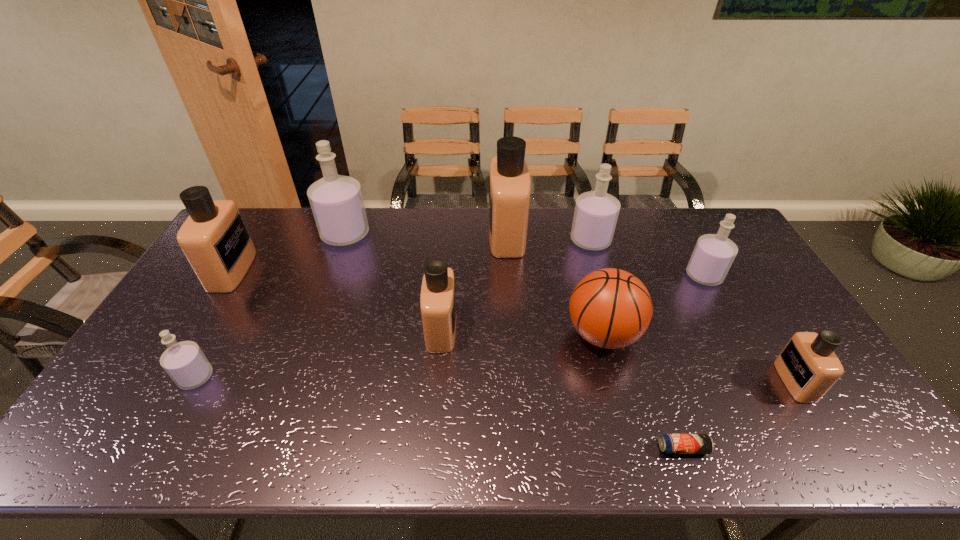
This screenshot has width=960, height=540. What are the coordinates of `vacant space located on the front label of the biggest beige perfume` in the screenshot? It's located at (444, 235).

Where is `free space located on the front of the biggest purple perfume`? This screenshot has width=960, height=540. free space located on the front of the biggest purple perfume is located at coordinates (330, 277).

I want to click on vacant space located 0.120m on the front label of the third smallest beige perfume, so click(x=285, y=270).

The image size is (960, 540). In order to click on free space located on the left of the second purple perfume from right to left in this screenshot , I will do `click(492, 240)`.

You are a GUI agent. You are given a task and a screenshot of the screen. Output one action in this format:
    pyautogui.click(x=<x>, y=<y>)
    Task: Click on the vacant region located on the back of the rightmost purple perfume
    The height and width of the screenshot is (540, 960).
    Given the screenshot: What is the action you would take?
    pyautogui.click(x=667, y=208)

Locate an element on the screen. The image size is (960, 540). free space located on the front label of the third beige perfume from right to left is located at coordinates (501, 329).

You are a GUI agent. You are given a task and a screenshot of the screen. Output one action in this format:
    pyautogui.click(x=<x>, y=<y>)
    Task: Click on the vacant region located 0.330m on the left of the basketball
    
    Given the screenshot: What is the action you would take?
    pyautogui.click(x=449, y=335)

I want to click on free space located 0.220m on the right of the leftmost purple perfume, so click(297, 377).

This screenshot has height=540, width=960. In order to click on free spot located on the front label of the smallest beige perfume in this screenshot , I will do `click(736, 381)`.

You are a GUI agent. You are given a task and a screenshot of the screen. Output one action in this format:
    pyautogui.click(x=<x>, y=<y>)
    Task: Click on the vacant space located on the front label of the smallest beige perfume
    
    Given the screenshot: What is the action you would take?
    pyautogui.click(x=663, y=381)